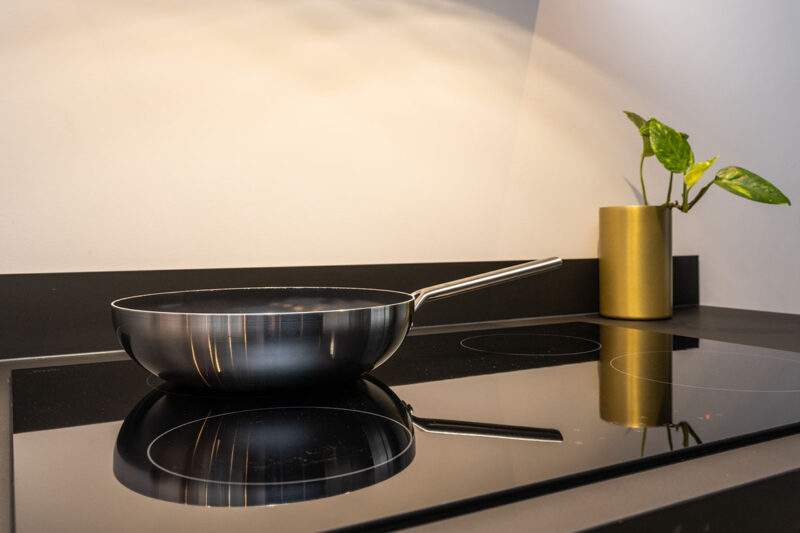
You are a GUI agent. You are given a task and a screenshot of the screen. Output one action in this format:
    pyautogui.click(x=<x>, y=<y>)
    Task: Click on the white wall / blank space
    
    Given the screenshot: What is the action you would take?
    pyautogui.click(x=342, y=127)